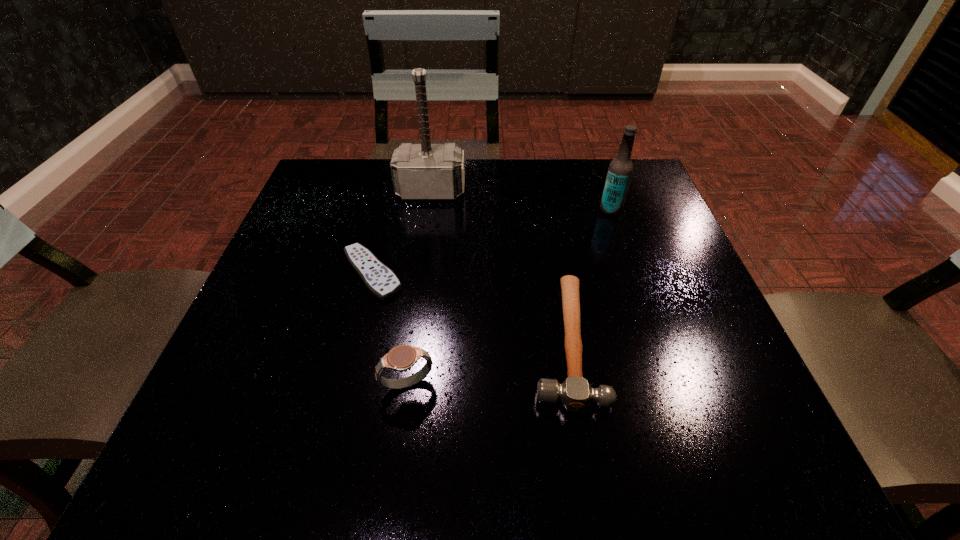
Find the location of a particular element. The image size is (960, 540). the left hammer is located at coordinates (425, 171).

At what (x,y) coordinates should I click in order to perform the action: click on the taller hammer. Please return your answer as a coordinate pair (x, y). This screenshot has width=960, height=540. Looking at the image, I should click on (425, 171).

This screenshot has height=540, width=960. Find the location of `beer bottle`. beer bottle is located at coordinates (620, 170).

What are the coordinates of `the fourth shortest object` in the screenshot? It's located at (620, 170).

Where is `the third tallest object`? Image resolution: width=960 pixels, height=540 pixels. the third tallest object is located at coordinates (400, 358).

I want to click on the second shortest object, so click(x=575, y=393).

Image resolution: width=960 pixels, height=540 pixels. I want to click on the shorter hammer, so click(575, 393).

Find the location of a particular element. The image size is (960, 540). remote control is located at coordinates pyautogui.click(x=379, y=279).

Image resolution: width=960 pixels, height=540 pixels. I want to click on free space located 0.240m for striking with the head of the tallest object, so click(420, 276).

Where is `vacant space situated on the label of the beer bottle`? This screenshot has height=540, width=960. vacant space situated on the label of the beer bottle is located at coordinates (426, 210).